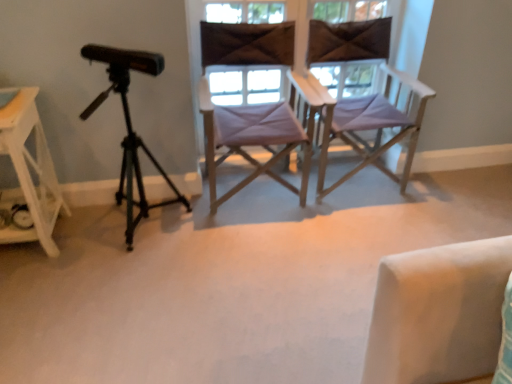
Locate an element on the screen. Image resolution: width=512 pixels, height=384 pixels. vacant region below purple fabric chair at center, arranged as the first chair when viewed from the left (from a real-world perspective) is located at coordinates (259, 198).